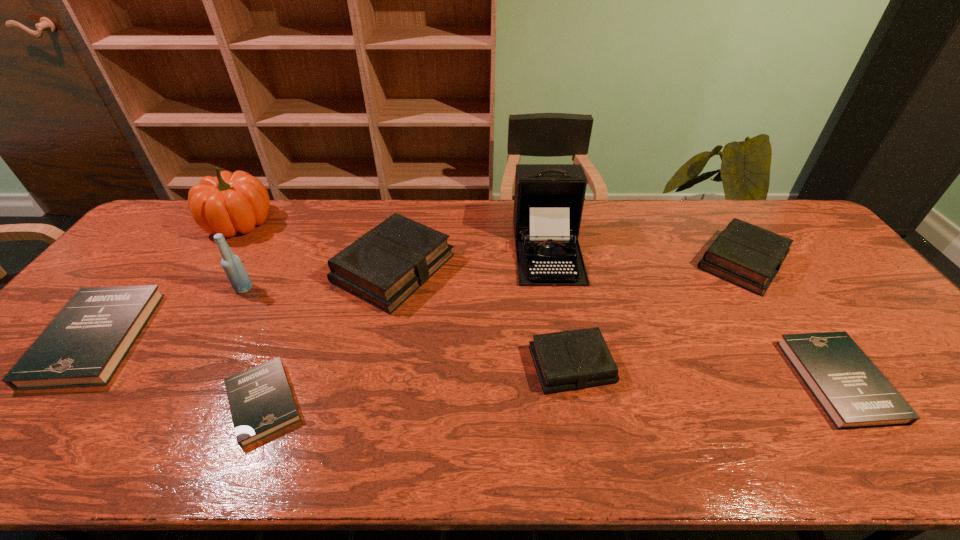
Locate an element on the screen. dark book that stands as the closest to the typewriter is located at coordinates (853, 392).

Identify the location of vacant space that satisfies the following two spatial constraints: 1. on the front side of the smallest dark book; 2. on the right side of the bottle. (180, 402).

Where is `blank area in the image that satisfies the following two spatial constraints: 1. on the front side of the smallest dark book; 2. on the right side of the pumpkin`? The image size is (960, 540). blank area in the image that satisfies the following two spatial constraints: 1. on the front side of the smallest dark book; 2. on the right side of the pumpkin is located at coordinates (119, 402).

You are a GUI agent. You are given a task and a screenshot of the screen. Output one action in this format:
    pyautogui.click(x=<x>, y=<y>)
    Task: Click on the vacant point that satisfies the following two spatial constraints: 1. inside the open case of the typewriter; 2. on the right side of the third tallest book
    This screenshot has height=540, width=960.
    Given the screenshot: What is the action you would take?
    pyautogui.click(x=568, y=364)